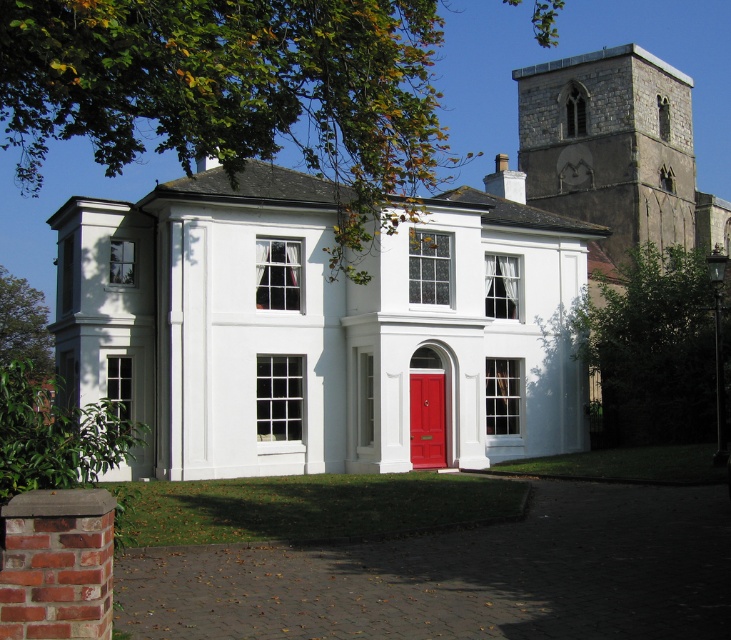
Question: Is stone tower at upper right below matte wood door at center?

Choices:
 (A) yes
 (B) no

Answer: (B)

Question: Which point is farther from the camera taking this photo?

Choices:
 (A) (238, 394)
 (B) (425, 435)

Answer: (B)

Question: Which point is closer to the camera?

Choices:
 (A) (439, 408)
 (B) (175, 234)

Answer: (B)

Question: Is stone tower at upper right smaller than matte wood door at center?

Choices:
 (A) no
 (B) yes

Answer: (A)

Question: Does stone tower at upper right appear under matte wood door at center?

Choices:
 (A) no
 (B) yes

Answer: (A)